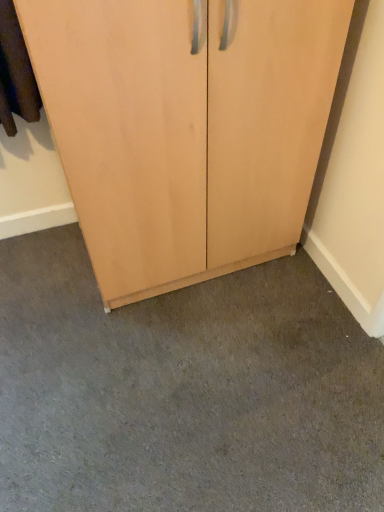
Question: Is light wood cupboard at center placed right next to gray carpet at lower center?

Choices:
 (A) no
 (B) yes

Answer: (A)

Question: Does light wood cupboard at center have a larger size compared to gray carpet at lower center?

Choices:
 (A) no
 (B) yes

Answer: (B)

Question: Is light wood cupboard at center taller than gray carpet at lower center?

Choices:
 (A) no
 (B) yes

Answer: (B)

Question: Does light wood cupboard at center contain gray carpet at lower center?

Choices:
 (A) no
 (B) yes

Answer: (A)

Question: Is light wood cupboard at center oriented away from gray carpet at lower center?

Choices:
 (A) yes
 (B) no

Answer: (B)

Question: Is light wood cupboard at center outside gray carpet at lower center?

Choices:
 (A) no
 (B) yes

Answer: (B)

Question: Can you confirm if gray carpet at lower center is shorter than light wood cupboard at center?

Choices:
 (A) yes
 (B) no

Answer: (A)

Question: Can you confirm if gray carpet at lower center is bigger than light wood cupboard at center?

Choices:
 (A) no
 (B) yes

Answer: (A)

Question: From a real-world perspective, does gray carpet at lower center stand above light wood cupboard at center?

Choices:
 (A) no
 (B) yes

Answer: (A)

Question: Does gray carpet at lower center appear on the left side of light wood cupboard at center?

Choices:
 (A) no
 (B) yes

Answer: (A)

Question: Is gray carpet at lower center to the right of light wood cupboard at center from the viewer's perspective?

Choices:
 (A) no
 (B) yes

Answer: (B)

Question: Is gray carpet at lower center completely or partially outside of light wood cupboard at center?

Choices:
 (A) no
 (B) yes

Answer: (B)

Question: Relative to light wood cupboard at center, is gray carpet at lower center in front or behind?

Choices:
 (A) front
 (B) behind

Answer: (B)